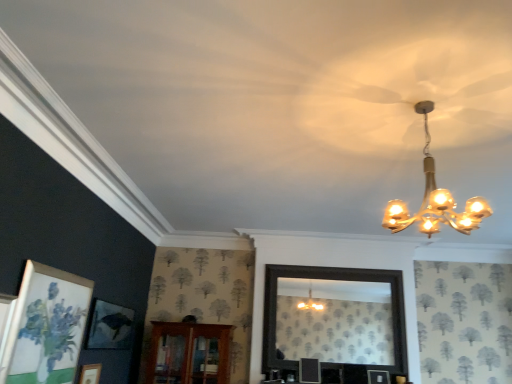
Question: In the image, is matte white picture frame at lower left positioned in front of or behind brown wooden cabinet at center?

Choices:
 (A) front
 (B) behind

Answer: (A)

Question: Is matte white picture frame at lower left inside the boundaries of brown wooden cabinet at center, or outside?

Choices:
 (A) outside
 (B) inside

Answer: (A)

Question: Based on their relative distances, which object is farther from the brown wooden cabinet at center?

Choices:
 (A) matte white picture frame at lower left
 (B) gold glass chandelier at upper right

Answer: (B)

Question: Estimate the real-world distances between objects in this image. Which object is closer to the matte white picture frame at lower left?

Choices:
 (A) brown wooden cabinet at center
 (B) gold glass chandelier at upper right

Answer: (A)